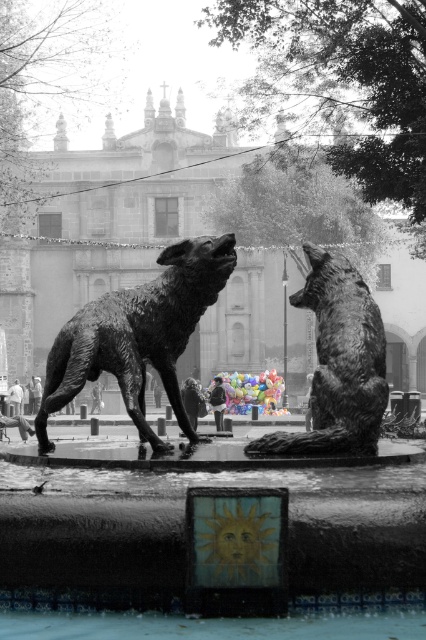
You are standing at the entrance of the square facing the ornate building. Which direction should you turn to face the bronze statue at center?

The bronze statue at center is located at point coordinates that are to the right of your current position when facing the building. Therefore, you should turn to your right to face the bronze statue at center.

Based on the scene description, what are the coordinates of the bronze statue at center?

The bronze statue at center is located at coordinates (183, 524).